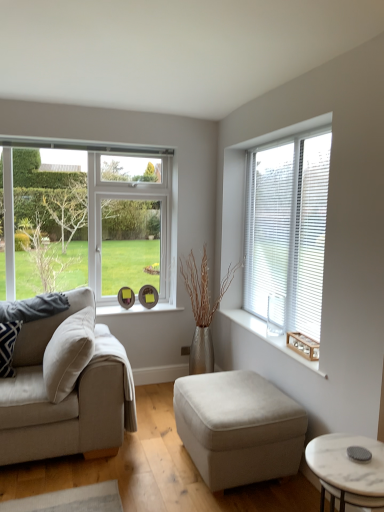
Question: Is beige fabric couch at left wider than white marble coffee table at lower right?

Choices:
 (A) yes
 (B) no

Answer: (A)

Question: Does beige fabric couch at left have a smaller size compared to white marble coffee table at lower right?

Choices:
 (A) yes
 (B) no

Answer: (B)

Question: Can you confirm if beige fabric couch at left is positioned to the right of white marble coffee table at lower right?

Choices:
 (A) yes
 (B) no

Answer: (B)

Question: Does beige fabric couch at left appear on the left side of white marble coffee table at lower right?

Choices:
 (A) no
 (B) yes

Answer: (B)

Question: Is beige fabric couch at left further to camera compared to white marble coffee table at lower right?

Choices:
 (A) yes
 (B) no

Answer: (A)

Question: Is white marble coffee table at lower right bigger or smaller than patterned fabric pillow at left?

Choices:
 (A) big
 (B) small

Answer: (A)

Question: In terms of width, does white marble coffee table at lower right look wider or thinner when compared to patterned fabric pillow at left?

Choices:
 (A) wide
 (B) thin

Answer: (A)

Question: Which is correct: white marble coffee table at lower right is inside patterned fabric pillow at left, or outside of it?

Choices:
 (A) inside
 (B) outside

Answer: (B)

Question: Based on their positions, is white marble coffee table at lower right located to the left or right of patterned fabric pillow at left?

Choices:
 (A) right
 (B) left

Answer: (A)

Question: Considering their positions, is beige fabric ottoman at center located in front of or behind patterned fabric pillow at left?

Choices:
 (A) front
 (B) behind

Answer: (A)

Question: In terms of width, does beige fabric ottoman at center look wider or thinner when compared to patterned fabric pillow at left?

Choices:
 (A) wide
 (B) thin

Answer: (A)

Question: In terms of height, does beige fabric ottoman at center look taller or shorter compared to patterned fabric pillow at left?

Choices:
 (A) short
 (B) tall

Answer: (B)

Question: In terms of size, does beige fabric ottoman at center appear bigger or smaller than patterned fabric pillow at left?

Choices:
 (A) small
 (B) big

Answer: (B)

Question: In terms of width, does patterned fabric pillow at left look wider or thinner when compared to clear glass window at left, which appears as the 1th window when viewed from the left?

Choices:
 (A) wide
 (B) thin

Answer: (A)

Question: Is patterned fabric pillow at left to the left or to the right of clear glass window at left, which appears as the 1th window when viewed from the left, in the image?

Choices:
 (A) left
 (B) right

Answer: (A)